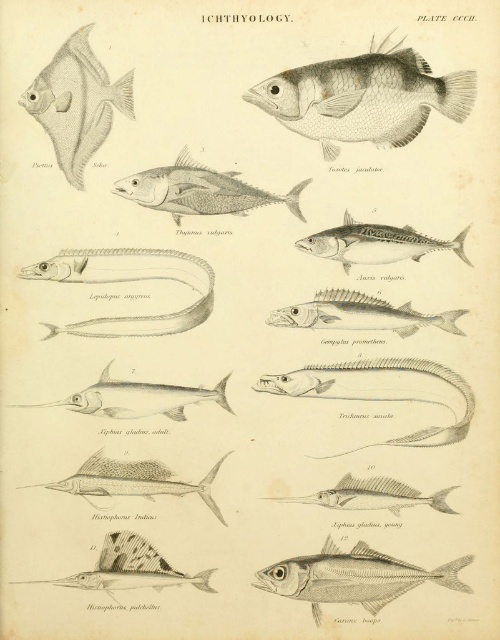
Question: Among these objects, which one is farthest from the camera?

Choices:
 (A) silver metallic swordfish at center
 (B) silver metallic sailfish at center
 (C) silver metallic fish at center
 (D) grayish silver fish at center

Answer: (A)

Question: From the image, what is the correct spatial relationship of silver metallic fish at center in relation to grayish-blue metallic sailfish at lower left?

Choices:
 (A) right
 (B) left

Answer: (A)

Question: Considering the real-world distances, which object is farthest from the translucent silver fish at upper left?

Choices:
 (A) gray matte fish at upper center
 (B) silver metallic mackerel at center
 (C) grayish metallic fish at center
 (D) grayish-blue metallic sailfish at lower left

Answer: (D)

Question: Which object is positioned farthest from the grayish silver fish at center?

Choices:
 (A) silver metallic fish at center
 (B) translucent silver fish at upper left
 (C) grayish metallic fish at center

Answer: (A)

Question: Is grayish silver fish at center positioned before silver metallic mackerel at center?

Choices:
 (A) no
 (B) yes

Answer: (B)

Question: Can you confirm if gray matte fish at upper center is wider than silver metallic fish at center?

Choices:
 (A) no
 (B) yes

Answer: (B)